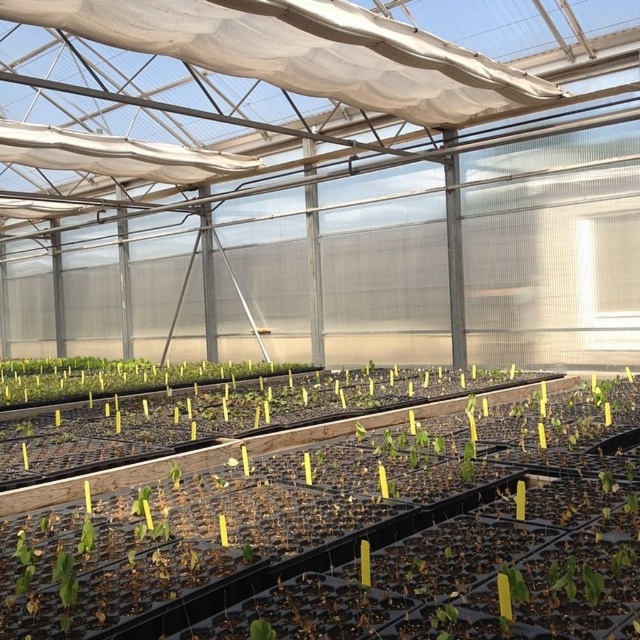
Question: Can you confirm if green matte seedling at center is bigger than green leafy plants at center?

Choices:
 (A) no
 (B) yes

Answer: (B)

Question: Which point appears farthest from the camera in this image?

Choices:
 (A) (259, 620)
 (B) (628, 492)

Answer: (B)

Question: Which point appears farthest from the camera in this image?

Choices:
 (A) (259, 484)
 (B) (252, 636)
 (C) (252, 550)
 (D) (68, 396)

Answer: (D)

Question: Does green matte leaf at center appear over green leafy plant at center?

Choices:
 (A) no
 (B) yes

Answer: (B)

Question: Can you confirm if green matte seedling at center is smaller than green leafy plant at center?

Choices:
 (A) yes
 (B) no

Answer: (B)

Question: Which of the following is the closest to the observer?

Choices:
 (A) green leafy plant at center
 (B) green leafy plants at center

Answer: (A)